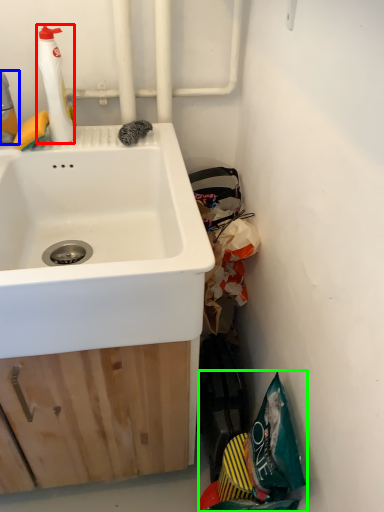
Question: Which object is positioned closest to cleaning product (highlighted by a red box)? Select from cleaning product (highlighted by a blue box) and garbage (highlighted by a green box).

Choices:
 (A) cleaning product
 (B) garbage

Answer: (A)